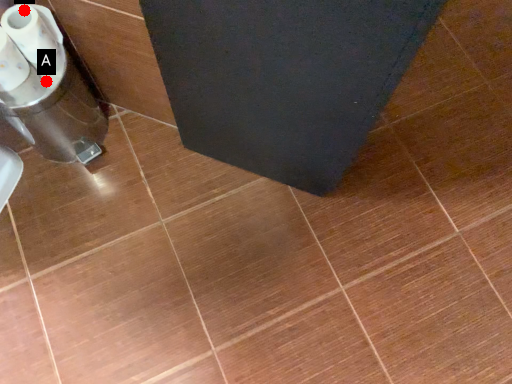
Question: Two points are circled on the image, labeled by A and B beside each circle. Which point is farther to the camera?

Choices:
 (A) A is further
 (B) B is further

Answer: (A)